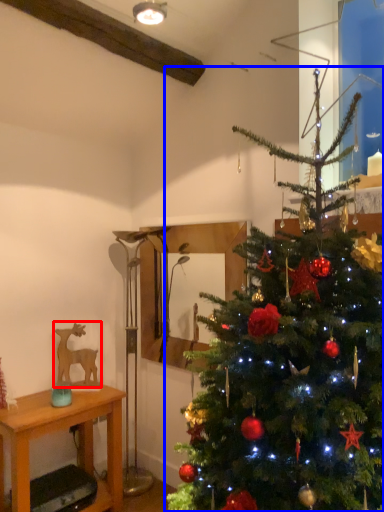
Question: Which of the following is the farthest to the observer, animal (highlighted by a red box) or christmas tree (highlighted by a blue box)?

Choices:
 (A) animal
 (B) christmas tree

Answer: (A)